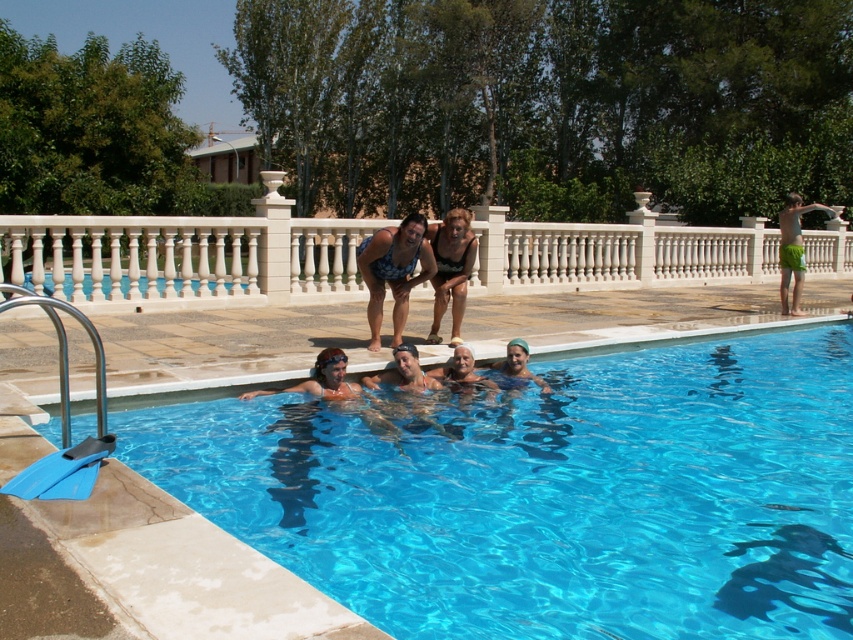
You are standing at the poolside and want to reach the point marked at coordinates [322,472]. Given that the pool is 15 feet wide, can you safely walk directly to that point without entering the water?

The point marked at coordinates [322,472] is 19.04 feet away from you. Since the pool is only 15 feet wide, the distance to the point exceeds the pool width, so you cannot safely walk directly to that point without entering the water.

You are standing on the pool deck and see the transparent blue water at center and the green fabric shorts at right. Which object is closer to the bottom of the image?

The transparent blue water at center is closer to the bottom of the image because it is not as tall as the green fabric shorts at right.